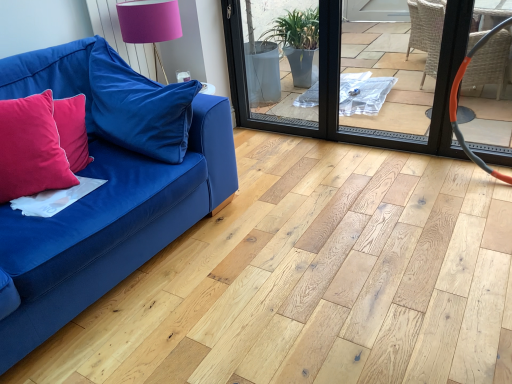
Locate an element on the screen. The height and width of the screenshot is (384, 512). velvet blue pillow at left, the second pillow viewed from the left is located at coordinates (138, 107).

Identify the location of pink fabric lampshade at upper center. (150, 24).

Describe the element at coordinates (338, 82) in the screenshot. Image resolution: width=512 pixels, height=384 pixels. I see `transparent plastic screen door at center` at that location.

This screenshot has height=384, width=512. Identify the location of velvet red pillow at left, the 1th pillow in the left-to-right sequence. (39, 145).

You are a GUI agent. You are given a task and a screenshot of the screen. Output one action in this format:
    pyautogui.click(x=<x>, y=<y>)
    Task: Click on the velvet blue couch at left
    This screenshot has width=512, height=384.
    Given the screenshot: What is the action you would take?
    pyautogui.click(x=106, y=191)

This screenshot has width=512, height=384. What do you see at coordinates (457, 102) in the screenshot?
I see `orange rubber hose at right` at bounding box center [457, 102].

Locate an element on the screen. velvet blue pillow at left, the second pillow viewed from the left is located at coordinates (138, 107).

From a real-world perspective, which is physically below, pink fabric lampshade at upper center or transparent plastic screen door at center?

transparent plastic screen door at center, from a real-world perspective.

From the picture: Is transparent plastic screen door at center located within pink fabric lampshade at upper center?

No.

Which is further, (122,14) or (319,125)?

The point (319,125) is farther from the camera.

Could you tell me if pink fabric lampshade at upper center is turned towards transparent plastic screen door at center?

No, pink fabric lampshade at upper center does not turn towards transparent plastic screen door at center.

Is orange rubber hose at right directly adjacent to velvet red pillow at left, the 1th pillow in the left-to-right sequence?

There is a gap between orange rubber hose at right and velvet red pillow at left, the 1th pillow in the left-to-right sequence.

From the picture: From a real-world perspective, is orange rubber hose at right under velvet red pillow at left, the second pillow in the right-to-left sequence?

Yes, from a real-world perspective, orange rubber hose at right is under velvet red pillow at left, the second pillow in the right-to-left sequence.

Is orange rubber hose at right positioned behind velvet red pillow at left, the 1th pillow in the left-to-right sequence?

Yes.

Is pink fabric lampshade at upper center positioned beyond the bounds of velvet blue pillow at left, arranged as the first pillow when viewed from the right?

Indeed, pink fabric lampshade at upper center is completely outside velvet blue pillow at left, arranged as the first pillow when viewed from the right.

Can you confirm if pink fabric lampshade at upper center is bigger than velvet blue pillow at left, the second pillow viewed from the left?

Actually, pink fabric lampshade at upper center might be smaller than velvet blue pillow at left, the second pillow viewed from the left.

Is point (132, 15) less distant than point (172, 99)?

No, it is not.

Does velvet blue couch at left have a lesser height compared to orange rubber hose at right?

Yes, velvet blue couch at left is shorter than orange rubber hose at right.

Based on the photo, is orange rubber hose at right at the back of velvet blue couch at left?

No, orange rubber hose at right is not at the back of velvet blue couch at left.

Is velvet blue couch at left in contact with orange rubber hose at right?

No, velvet blue couch at left is not next to orange rubber hose at right.

Considering the positions of point (98, 262) and point (477, 163), is point (98, 262) closer or farther from the camera than point (477, 163)?

Point (98, 262) appears to be closer to the viewer than point (477, 163).

Who is bigger, orange rubber hose at right or velvet blue pillow at left, arranged as the first pillow when viewed from the right?

With larger size is velvet blue pillow at left, arranged as the first pillow when viewed from the right.

Considering the relative positions of orange rubber hose at right and velvet blue pillow at left, arranged as the first pillow when viewed from the right, in the image provided, is orange rubber hose at right to the left of velvet blue pillow at left, arranged as the first pillow when viewed from the right, from the viewer's perspective?

No, orange rubber hose at right is not to the left of velvet blue pillow at left, arranged as the first pillow when viewed from the right.

Is orange rubber hose at right wider than velvet blue pillow at left, the second pillow viewed from the left?

Incorrect, the width of orange rubber hose at right does not surpass that of velvet blue pillow at left, the second pillow viewed from the left.

Based on their sizes in the image, would you say velvet blue pillow at left, arranged as the first pillow when viewed from the right, is bigger or smaller than transparent plastic screen door at center?

In the image, velvet blue pillow at left, arranged as the first pillow when viewed from the right, appears to be smaller than transparent plastic screen door at center.

Where is `pillow that is the 1st one when counting downward from the transparent plastic screen door at center (from the image's perspective)`? pillow that is the 1st one when counting downward from the transparent plastic screen door at center (from the image's perspective) is located at coordinates (138, 107).

Is the depth of velvet blue pillow at left, the second pillow viewed from the left, less than that of transparent plastic screen door at center?

Yes, velvet blue pillow at left, the second pillow viewed from the left, is in front of transparent plastic screen door at center.

Which of these two, velvet blue couch at left or transparent plastic screen door at center, is bigger?

Bigger between the two is velvet blue couch at left.

Who is taller, velvet blue couch at left or transparent plastic screen door at center?

With more height is transparent plastic screen door at center.

Is velvet blue couch at left facing towards transparent plastic screen door at center?

No, velvet blue couch at left is not oriented towards transparent plastic screen door at center.

Find the location of a particular element. The image size is (512, 384). screen door below the pink fabric lampshade at upper center (from the image's perspective) is located at coordinates (338, 82).

Find the location of a particular element. This screenshot has height=384, width=512. armchair to the right of velvet red pillow at left, the 1th pillow in the left-to-right sequence is located at coordinates (457, 102).

From the image, which object appears to be farther from velvet blue pillow at left, arranged as the first pillow when viewed from the right, transparent plastic screen door at center or velvet blue couch at left?

Based on the image, transparent plastic screen door at center appears to be further to velvet blue pillow at left, arranged as the first pillow when viewed from the right.

When comparing their distances from velvet blue pillow at left, the second pillow viewed from the left, does velvet blue couch at left or orange rubber hose at right seem further?

orange rubber hose at right.

Consider the image. Which object lies nearer to the anchor point velvet blue couch at left, transparent plastic screen door at center or pink fabric lampshade at upper center?

pink fabric lampshade at upper center is closer to velvet blue couch at left.

Based on the photo, when comparing their distances from velvet red pillow at left, the 1th pillow in the left-to-right sequence, does pink fabric lampshade at upper center or transparent plastic screen door at center seem further?

Among the two, transparent plastic screen door at center is located further to velvet red pillow at left, the 1th pillow in the left-to-right sequence.

Based on the photo, looking at the image, which one is located further to transparent plastic screen door at center, velvet blue pillow at left, arranged as the first pillow when viewed from the right, or velvet blue couch at left?

Among the two, velvet blue couch at left is located further to transparent plastic screen door at center.

Considering their positions, is pink fabric lampshade at upper center positioned closer to velvet blue couch at left than velvet red pillow at left, the second pillow in the right-to-left sequence?

The object closer to velvet blue couch at left is velvet red pillow at left, the second pillow in the right-to-left sequence.

When comparing their distances from velvet blue couch at left, does pink fabric lampshade at upper center or transparent plastic screen door at center seem further?

Based on the image, transparent plastic screen door at center appears to be further to velvet blue couch at left.

Considering their positions, is pink fabric lampshade at upper center positioned further to velvet blue couch at left than orange rubber hose at right?

orange rubber hose at right is positioned further to the anchor velvet blue couch at left.

The width and height of the screenshot is (512, 384). What are the coordinates of `pillow between pink fabric lampshade at upper center and transparent plastic screen door at center` in the screenshot? It's located at (138, 107).

The image size is (512, 384). Identify the location of screen door between pink fabric lampshade at upper center and orange rubber hose at right in the horizontal direction. (338, 82).

The width and height of the screenshot is (512, 384). I want to click on pillow between velvet red pillow at left, the second pillow in the right-to-left sequence, and pink fabric lampshade at upper center, along the z-axis, so click(x=138, y=107).

This screenshot has width=512, height=384. What are the coordinates of `screen door situated between velvet red pillow at left, the 1th pillow in the left-to-right sequence, and orange rubber hose at right from left to right` in the screenshot? It's located at (338, 82).